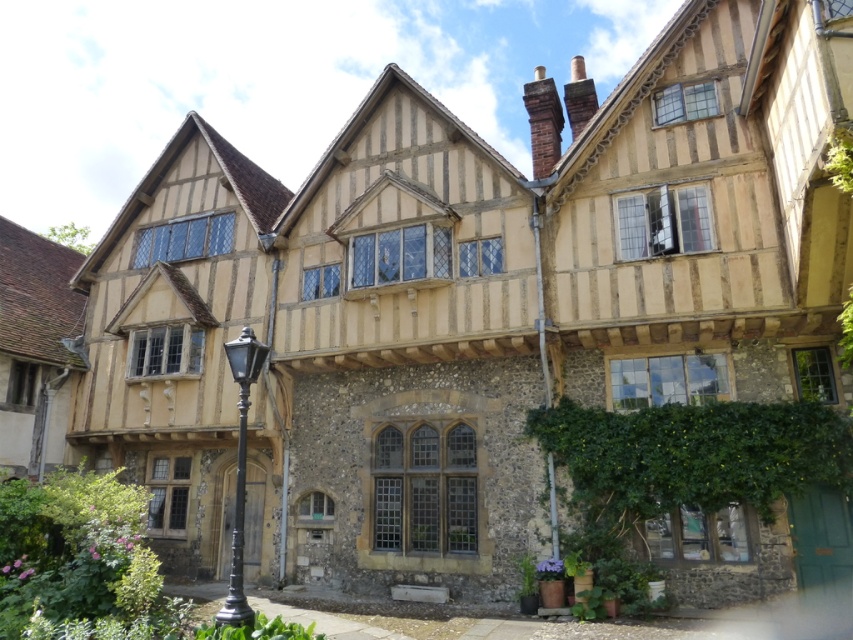
Is green leafy ivy at lower right behind black polished metal lamp post at lower left?

Yes, green leafy ivy at lower right is further from the viewer.

Is green leafy ivy at lower right positioned in front of black polished metal lamp post at lower left?

No.

Does point (746, 483) come in front of point (239, 545)?

No, (746, 483) is further to viewer.

At what (x,y) coordinates should I click in order to perform the action: click on green leafy ivy at lower right. Please return your answer as a coordinate pair (x, y). The width and height of the screenshot is (853, 640). Looking at the image, I should click on (692, 456).

Is green leafy ivy at lower right behind metallic pole at right?

No, it is not.

Which is more to the right, green leafy ivy at lower right or metallic pole at right?

green leafy ivy at lower right

Describe the element at coordinates (692, 456) in the screenshot. I see `green leafy ivy at lower right` at that location.

Locate an element on the screen. This screenshot has width=853, height=640. green leafy ivy at lower right is located at coordinates (692, 456).

Locate an element on the screen. This screenshot has height=640, width=853. black polished metal lamp post at lower left is located at coordinates (241, 472).

From the picture: Can you confirm if black polished metal lamp post at lower left is bigger than metallic pole at right?

Yes, black polished metal lamp post at lower left is bigger than metallic pole at right.

The height and width of the screenshot is (640, 853). In order to click on black polished metal lamp post at lower left in this screenshot , I will do (x=241, y=472).

You are a GUI agent. You are given a task and a screenshot of the screen. Output one action in this format:
    pyautogui.click(x=<x>, y=<y>)
    Task: Click on the black polished metal lamp post at lower left
    This screenshot has width=853, height=640.
    Given the screenshot: What is the action you would take?
    pyautogui.click(x=241, y=472)